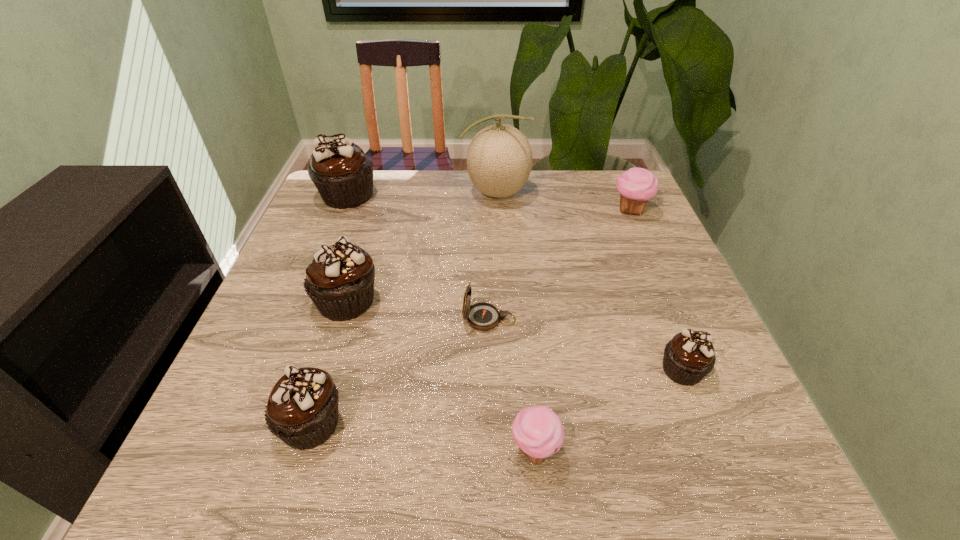
Find the location of a particular element. The image size is (960, 540). vacant space at the right edge of the desktop is located at coordinates (680, 314).

In the image, there is a desktop. What are the coordinates of `free space at the near left corner` in the screenshot? It's located at (268, 440).

At what (x,y) coordinates should I click in order to perform the action: click on vacant region at the far right corner of the desktop. Please return your answer as a coordinate pair (x, y). Image resolution: width=960 pixels, height=540 pixels. Looking at the image, I should click on (595, 176).

The image size is (960, 540). I want to click on vacant space in between the bigger pink cupcake and the tallest cupcake, so click(489, 203).

Locate an element on the screen. The height and width of the screenshot is (540, 960). free point between the third farthest brown cupcake and the tallest object is located at coordinates (589, 281).

This screenshot has height=540, width=960. I want to click on free space between the farther pink cupcake and the tallest object, so click(564, 201).

At what (x,y) coordinates should I click in order to perform the action: click on free spot between the left pink cupcake and the farthest brown cupcake. Please return your answer as a coordinate pair (x, y). Looking at the image, I should click on (441, 322).

Locate an element on the screen. The width and height of the screenshot is (960, 540). vacant space in between the tallest object and the third nearest cupcake is located at coordinates (589, 281).

Locate an element on the screen. vacant space that is in between the smallest brown cupcake and the farther pink cupcake is located at coordinates (657, 290).

Locate an element on the screen. This screenshot has height=540, width=960. vacant space that is in between the cantaloup and the right pink cupcake is located at coordinates (564, 201).